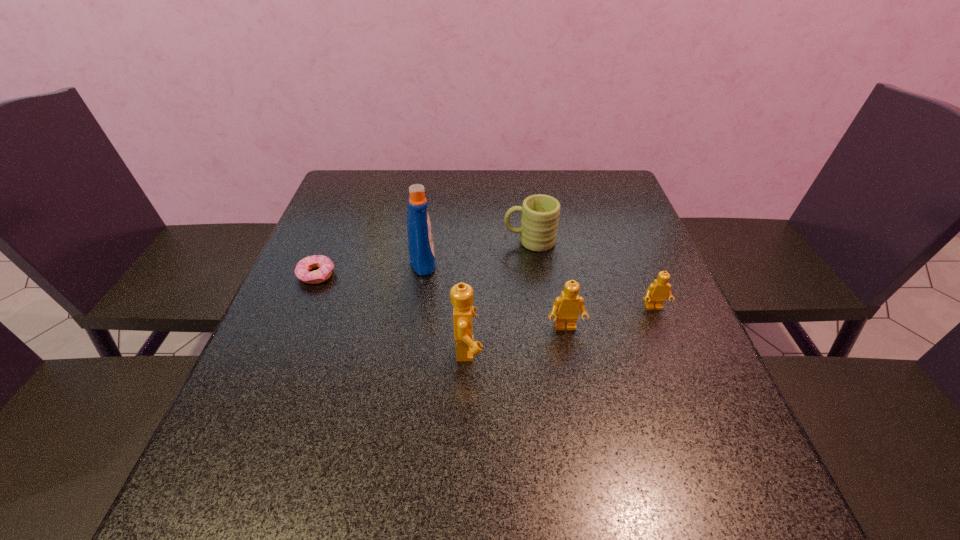
Find the location of a particular element. The height and width of the screenshot is (540, 960). vacant space at the far edge is located at coordinates (411, 183).

The width and height of the screenshot is (960, 540). I want to click on vacant position at the near edge of the desktop, so click(414, 434).

The image size is (960, 540). Identify the location of free location at the left edge of the desktop. (365, 259).

At what (x,y) coordinates should I click in order to perform the action: click on vacant space at the right edge. Please return your answer as a coordinate pair (x, y). Looking at the image, I should click on (612, 277).

This screenshot has width=960, height=540. In the image, there is a desktop. Find the location of `vacant space at the far left corner`. vacant space at the far left corner is located at coordinates (348, 184).

I want to click on free spot at the far right corner of the desktop, so click(630, 201).

Find the location of `free space between the fifth object from right to left and the second shortest object`. free space between the fifth object from right to left and the second shortest object is located at coordinates (539, 284).

I want to click on empty location between the doughnut and the second object from left to right, so click(370, 268).

Where is `free space between the detergent and the rightmost object`? free space between the detergent and the rightmost object is located at coordinates (539, 284).

In order to click on vacant area that lies between the tallest object and the fourth object from right to left in this screenshot , I will do `click(445, 305)`.